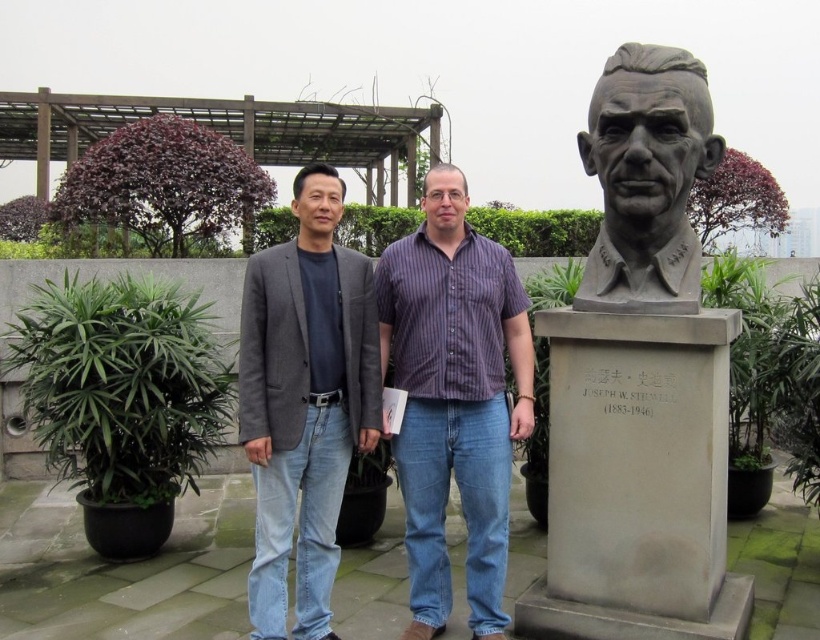
Who is taller, gray stone bust at right or bronze bust at right?

gray stone bust at right

Which is more to the right, gray stone bust at right or bronze bust at right?

gray stone bust at right is more to the right.

Does point (714, 420) come farther from viewer compared to point (595, 113)?

No, it is not.

Locate an element on the screen. This screenshot has width=820, height=640. gray stone bust at right is located at coordinates (640, 381).

Does purple striped shirt at center have a lesser width compared to bronze bust at right?

No, purple striped shirt at center is not thinner than bronze bust at right.

Can you confirm if purple striped shirt at center is wider than bronze bust at right?

Yes.

This screenshot has height=640, width=820. In order to click on purple striped shirt at center in this screenshot , I will do `click(454, 397)`.

Based on the photo, who is shorter, purple striped shirt at center or gray wool blazer at center?

Standing shorter between the two is purple striped shirt at center.

Where is `purple striped shirt at center`? purple striped shirt at center is located at coordinates (454, 397).